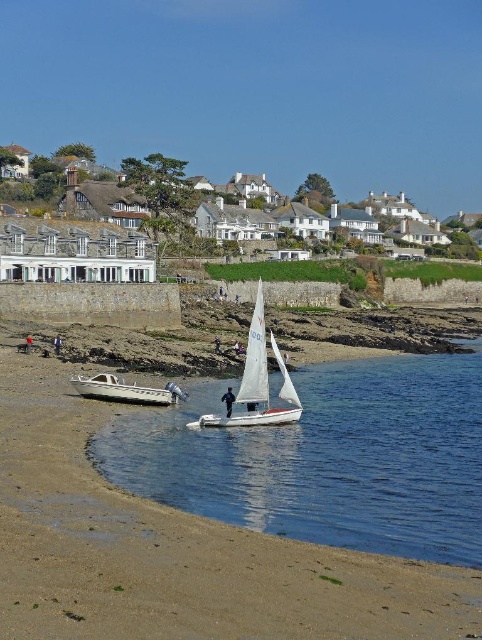
Which is in front, point (152, 397) or point (26, 346)?

Point (152, 397) is in front.

Does white plastic dinghy at lower left have a greater height compared to dark blue jeans at lower left?

Yes, white plastic dinghy at lower left is taller than dark blue jeans at lower left.

Image resolution: width=482 pixels, height=640 pixels. I want to click on white plastic dinghy at lower left, so click(x=125, y=390).

Find the location of a particular element. white plastic dinghy at lower left is located at coordinates (125, 390).

Is clear blue water at center thinner than white plastic dinghy at lower left?

No.

Which is in front, point (320, 390) or point (187, 394)?

Point (187, 394) is more forward.

Between point (423, 438) and point (131, 394), which one is positioned behind?

The point (131, 394) is more distant.

Locate an element on the screen. clear blue water at center is located at coordinates (327, 458).

Which is more to the right, clear blue water at center or dark blue fabric sailboat at center?

Positioned to the right is clear blue water at center.

Can you confirm if clear blue water at center is smaller than dark blue fabric sailboat at center?

No, clear blue water at center is not smaller than dark blue fabric sailboat at center.

Describe the element at coordinates (327, 458) in the screenshot. I see `clear blue water at center` at that location.

Image resolution: width=482 pixels, height=640 pixels. Find the location of `clear blue water at center`. clear blue water at center is located at coordinates (327, 458).